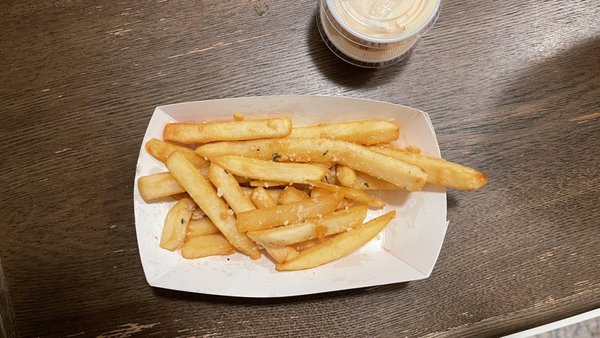
In order to click on plastic cups in this screenshot , I will do `click(366, 55)`, `click(380, 13)`.